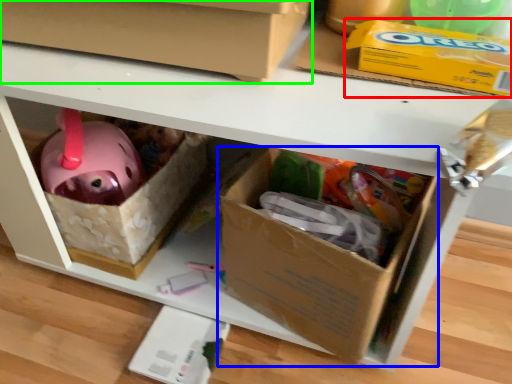
Question: Which object is positioned farthest from storage box (highlighted by a red box)? Select from box (highlighted by a blue box) and box (highlighted by a green box).

Choices:
 (A) box
 (B) box

Answer: (A)